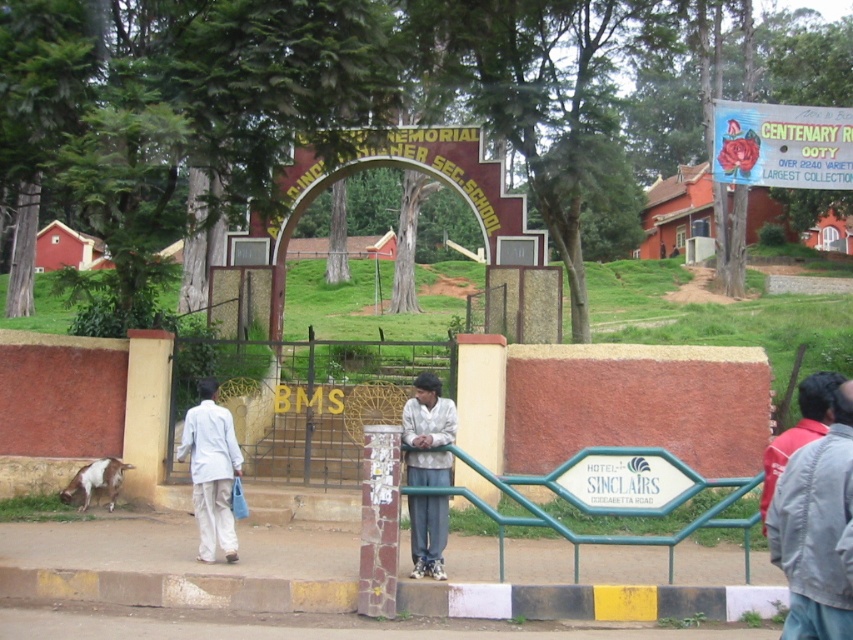
You are a visitor at the school entrance and want to know who is closer to the gate. You see a person wearing light beige fabric pants at center and another wearing white cotton shirt at left. Which person is closer to the gate?

The light beige fabric pants at center is in front of the white cotton shirt at left, so the person wearing light beige fabric pants at center is closer to the gate.

Based on the photo, you are a visitor at the school entrance. You see a person wearing white cotton shirt at left and another wearing light beige fabric pants at center. Which clothing item is positioned more to the left?

The white cotton shirt at left is more to the left than the light beige fabric pants at center.